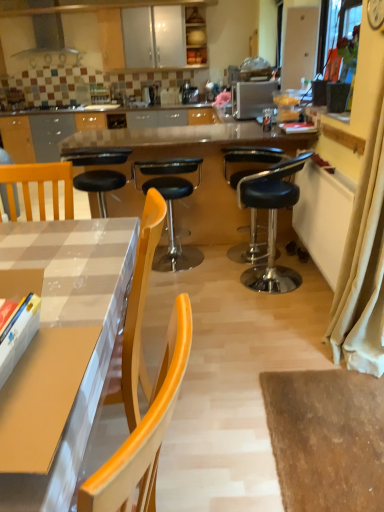
Question: Considering the relative sizes of wooden chair at left and metallic silver toaster at upper center in the image provided, is wooden chair at left smaller than metallic silver toaster at upper center?

Choices:
 (A) no
 (B) yes

Answer: (B)

Question: From the image's perspective, is wooden chair at left under metallic silver toaster at upper center?

Choices:
 (A) no
 (B) yes

Answer: (B)

Question: Can you confirm if wooden chair at left is positioned to the left of metallic silver toaster at upper center?

Choices:
 (A) yes
 (B) no

Answer: (A)

Question: From a real-world perspective, does wooden chair at left stand above metallic silver toaster at upper center?

Choices:
 (A) yes
 (B) no

Answer: (B)

Question: Is wooden chair at left located outside metallic silver toaster at upper center?

Choices:
 (A) no
 (B) yes

Answer: (B)

Question: In terms of width, does metallic silver range hood at upper center look wider or thinner when compared to orange plastic chair at center, which is the third chair from right to left?

Choices:
 (A) thin
 (B) wide

Answer: (A)

Question: In the image, is metallic silver range hood at upper center on the left side or the right side of orange plastic chair at center, which is the 1th chair from left to right?

Choices:
 (A) right
 (B) left

Answer: (B)

Question: In terms of height, does metallic silver range hood at upper center look taller or shorter compared to orange plastic chair at center, which is the 1th chair from left to right?

Choices:
 (A) tall
 (B) short

Answer: (B)

Question: Relative to orange plastic chair at center, which is the third chair from right to left, is metallic silver range hood at upper center in front or behind?

Choices:
 (A) front
 (B) behind

Answer: (B)

Question: From a real-world perspective, is black leather stool at center, which is the third chair in left-to-right order, above or below metallic silver range hood at upper center?

Choices:
 (A) above
 (B) below

Answer: (B)

Question: Relative to metallic silver range hood at upper center, is black leather stool at center, which is the third chair in left-to-right order, in front or behind?

Choices:
 (A) behind
 (B) front

Answer: (B)

Question: In the image, is black leather stool at center, which is the third chair in left-to-right order, on the left side or the right side of metallic silver range hood at upper center?

Choices:
 (A) right
 (B) left

Answer: (A)

Question: Is black leather stool at center, which is counted as the first chair, starting from the right, situated inside metallic silver range hood at upper center or outside?

Choices:
 (A) outside
 (B) inside

Answer: (A)

Question: From a real-world perspective, is white paper at center physically located above or below black leather stool at center, arranged as the second chair when viewed from the left?

Choices:
 (A) below
 (B) above

Answer: (B)

Question: Visually, is white paper at center positioned to the left or to the right of black leather stool at center, arranged as the second chair when viewed from the left?

Choices:
 (A) left
 (B) right

Answer: (B)